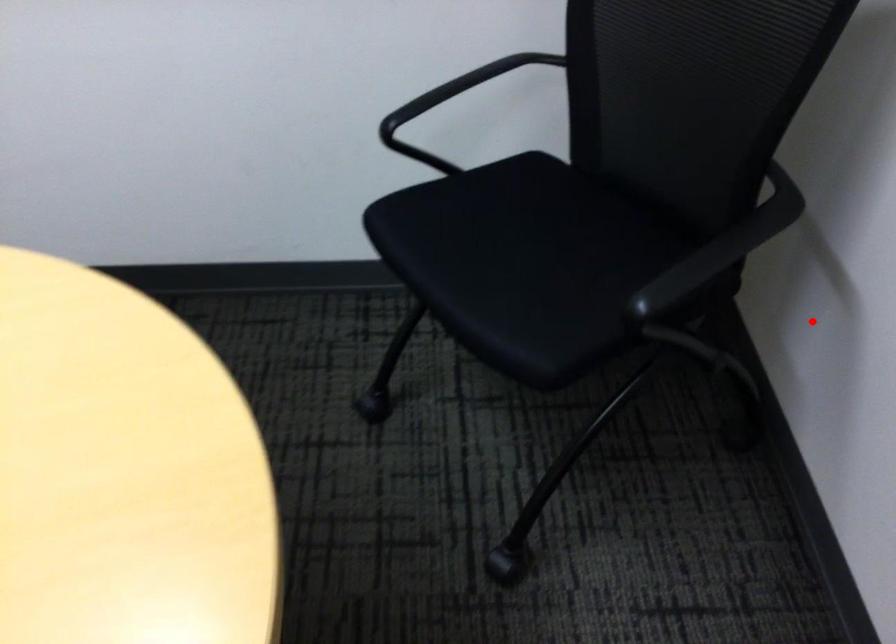
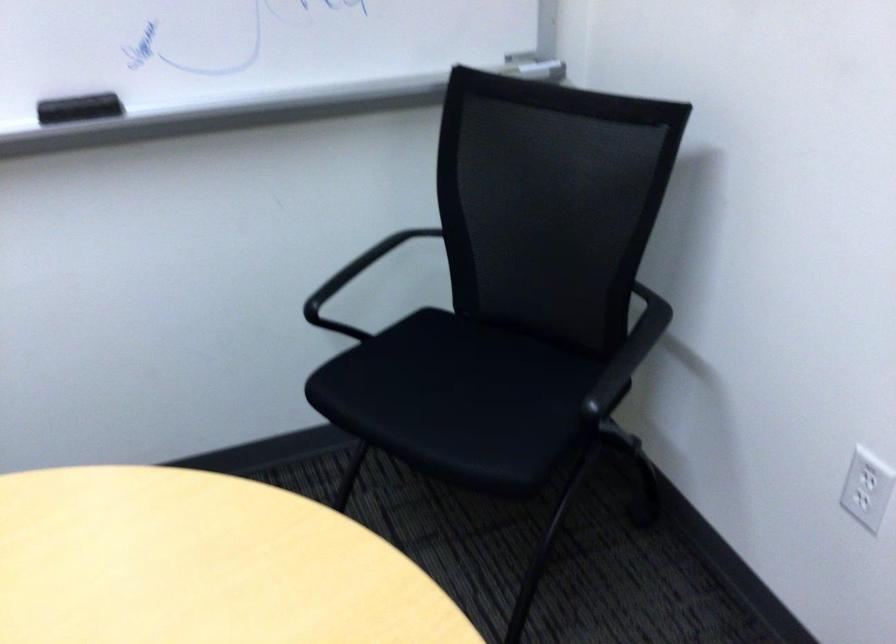
The point at the highlighted location is marked in the first image. Where is the corresponding point in the second image?

(673, 399)